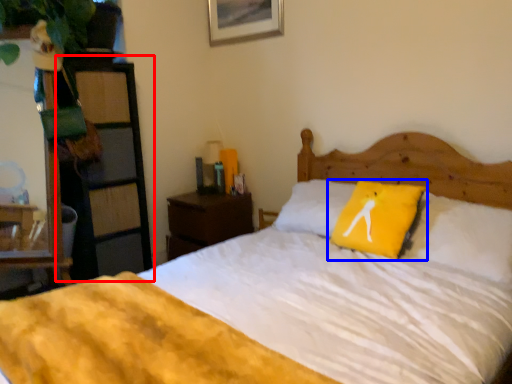
Question: Which object is closer to the camera taking this photo, dresser (highlighted by a red box) or pillow (highlighted by a blue box)?

Choices:
 (A) dresser
 (B) pillow

Answer: (B)